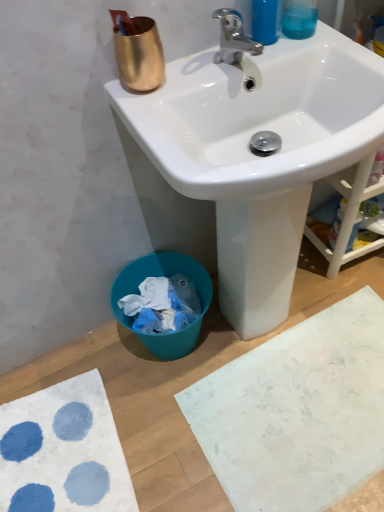
The height and width of the screenshot is (512, 384). I want to click on vacant region below white textured bath mat at lower left, positioned as the second bath mat in right-to-left order (from a real-world perspective), so click(58, 452).